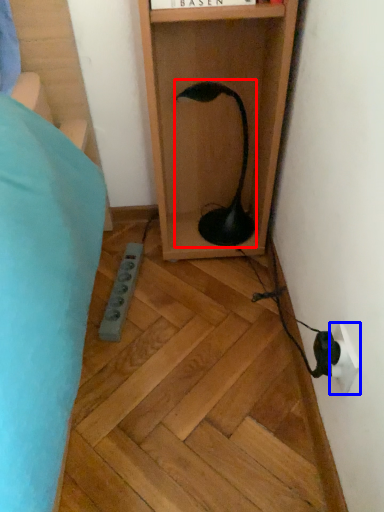
Question: Among these objects, which one is farthest to the camera, lamp (highlighted by a red box) or electric outlet (highlighted by a blue box)?

Choices:
 (A) lamp
 (B) electric outlet

Answer: (A)